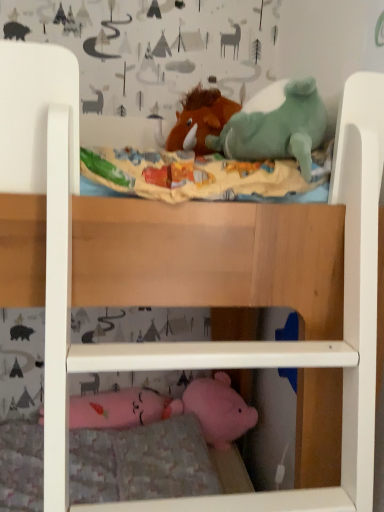
The image size is (384, 512). Find the location of `pink plush at lower center`. pink plush at lower center is located at coordinates (164, 461).

Describe the element at coordinates (164, 461) in the screenshot. This screenshot has height=512, width=384. I see `pink plush at lower center` at that location.

This screenshot has height=512, width=384. What do you see at coordinates (200, 119) in the screenshot?
I see `brown plush horse at upper center` at bounding box center [200, 119].

Where is `brown plush horse at upper center`? This screenshot has width=384, height=512. brown plush horse at upper center is located at coordinates (200, 119).

Where is `pink plush at lower center`? pink plush at lower center is located at coordinates (164, 461).

Considering the positions of objects brown plush horse at upper center and pink plush at lower center in the image provided, who is more to the right, brown plush horse at upper center or pink plush at lower center?

brown plush horse at upper center is more to the right.

Is the depth of brown plush horse at upper center less than that of pink plush at lower center?

That is False.

Does point (190, 114) lie behind point (170, 479)?

Yes, point (190, 114) is farther from viewer.

From the image's perspective, is brown plush horse at upper center located above or below pink plush at lower center?

Based on their image positions, brown plush horse at upper center is located above pink plush at lower center.

From a real-world perspective, which is physically below, brown plush horse at upper center or pink plush at lower center?

pink plush at lower center.

Can you confirm if brown plush horse at upper center is thinner than pink plush at lower center?

Yes.

Is brown plush horse at upper center taller than pink plush at lower center?

Yes, brown plush horse at upper center is taller than pink plush at lower center.

Does brown plush horse at upper center have a smaller size compared to pink plush at lower center?

Yes, brown plush horse at upper center is smaller than pink plush at lower center.

Is brown plush horse at upper center surrounding pink plush at lower center?

No, pink plush at lower center is located outside of brown plush horse at upper center.

Based on the photo, is brown plush horse at upper center far from pink plush at lower center?

Indeed, brown plush horse at upper center is not near pink plush at lower center.

Is brown plush horse at upper center looking in the opposite direction of pink plush at lower center?

No, pink plush at lower center is not at the back of brown plush horse at upper center.

Can you tell me how much brown plush horse at upper center and pink plush at lower center differ in facing direction?

88.9 degrees separate the facing orientations of brown plush horse at upper center and pink plush at lower center.

You are a GUI agent. You are given a task and a screenshot of the screen. Output one action in this format:
    pyautogui.click(x=<x>, y=<y>)
    Task: Click on the pillow in front of the brown plush horse at upper center
    This screenshot has width=384, height=512.
    Given the screenshot: What is the action you would take?
    pyautogui.click(x=164, y=461)

Which is more to the right, pink plush at lower center or brown plush horse at upper center?

Positioned to the right is brown plush horse at upper center.

Considering the relative positions of pink plush at lower center and brown plush horse at upper center in the image provided, is pink plush at lower center behind brown plush horse at upper center?

No, the depth of pink plush at lower center is less than that of brown plush horse at upper center.

Is point (151, 477) positioned behind point (194, 144)?

Yes, point (151, 477) is behind point (194, 144).

From the image's perspective, is pink plush at lower center over brown plush horse at upper center?

Incorrect, from the image's perspective, pink plush at lower center is lower than brown plush horse at upper center.

From a real-world perspective, between pink plush at lower center and brown plush horse at upper center, who is vertically lower?

In real-world perspective, pink plush at lower center is lower.

Between pink plush at lower center and brown plush horse at upper center, which one has smaller width?

With smaller width is brown plush horse at upper center.

In terms of height, does pink plush at lower center look taller or shorter compared to brown plush horse at upper center?

Considering their sizes, pink plush at lower center has less height than brown plush horse at upper center.

Which of these two, pink plush at lower center or brown plush horse at upper center, is smaller?

brown plush horse at upper center.

Consider the image. Is pink plush at lower center spatially inside brown plush horse at upper center, or outside of it?

pink plush at lower center is not inside brown plush horse at upper center, it's outside.

Looking at this image, is pink plush at lower center far away from brown plush horse at upper center?

Absolutely, pink plush at lower center is distant from brown plush horse at upper center.

Is pink plush at lower center oriented towards brown plush horse at upper center?

No.

How different are the orientations of pink plush at lower center and brown plush horse at upper center in degrees?

pink plush at lower center and brown plush horse at upper center are facing 88.9 degrees away from each other.

How much distance is there between pink plush at lower center and brown plush horse at upper center?

A distance of 1.09 meters exists between pink plush at lower center and brown plush horse at upper center.

Identify the location of toy above the pink plush at lower center (from a real-world perspective). The image size is (384, 512). (200, 119).

Find the location of a particular element. The height and width of the screenshot is (512, 384). pillow directly beneath the brown plush horse at upper center (from a real-world perspective) is located at coordinates (164, 461).

What are the coordinates of `toy above the pink plush at lower center (from a real-world perspective)` in the screenshot? It's located at (200, 119).